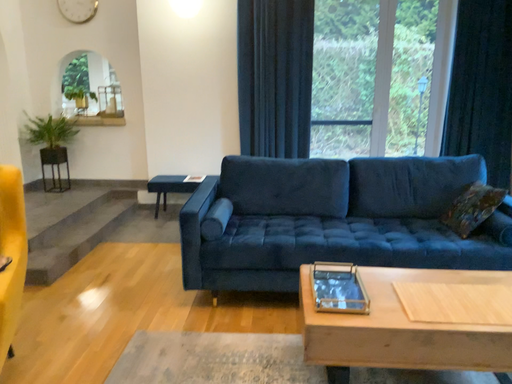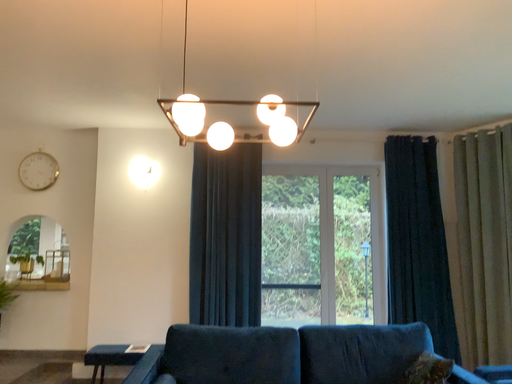
Question: How did the camera likely rotate when shooting the video?

Choices:
 (A) rotated upward
 (B) rotated downward

Answer: (A)